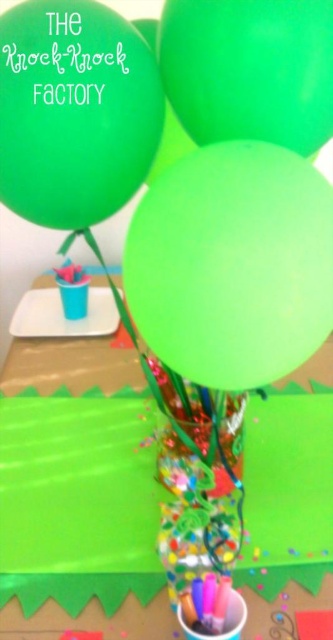
Can you confirm if green rubber balloon at center is taller than matte green balloon at upper left?

Yes.

Identify the location of green rubber balloon at center. click(x=233, y=264).

Is green rubber balloon at center smaller than green matte balloon at upper center?

No.

At what (x,y) coordinates should I click in order to perform the action: click on green rubber balloon at center. Please return your answer as a coordinate pair (x, y). Looking at the image, I should click on (233, 264).

Between point (246, 371) and point (250, 112), which one is positioned in front?

Point (246, 371) is more forward.

Identify the location of green rubber balloon at center. This screenshot has width=333, height=640. (233, 264).

Is matte green balloon at upper left in front of green matte balloon at upper center?

No, it is not.

Between matte green balloon at upper left and green matte balloon at upper center, which one has more height?

With more height is matte green balloon at upper left.

Where is `matte green balloon at upper left`? This screenshot has width=333, height=640. matte green balloon at upper left is located at coordinates (73, 112).